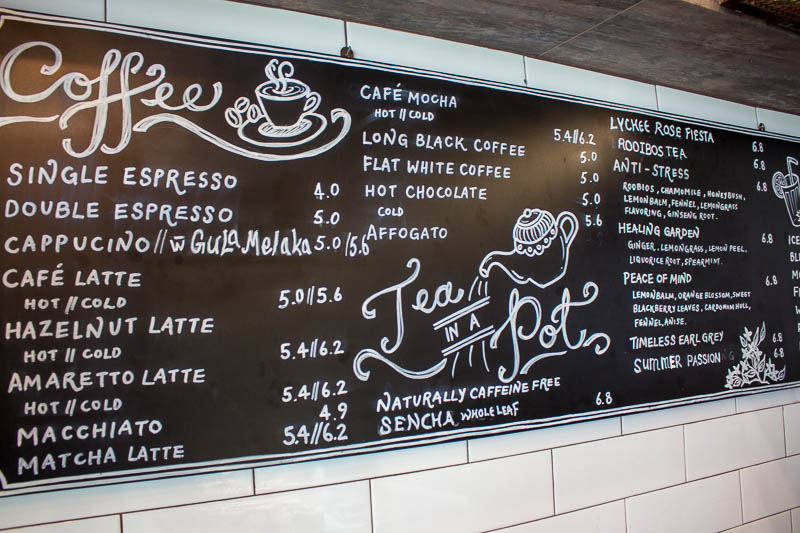
Where is `cup`? This screenshot has width=800, height=533. cup is located at coordinates (277, 88).